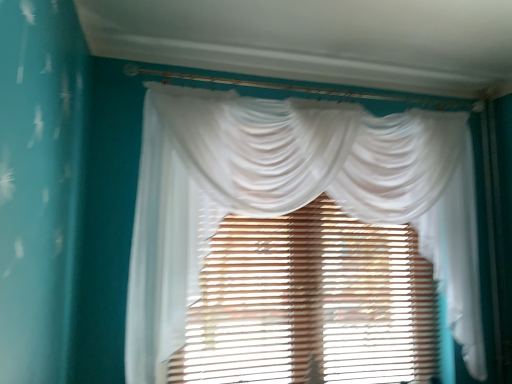
Describe the element at coordinates (311, 303) in the screenshot. The width and height of the screenshot is (512, 384). I see `translucent wood blinds at center` at that location.

You are a GUI agent. You are given a task and a screenshot of the screen. Output one action in this format:
    pyautogui.click(x=<x>, y=<y>)
    Task: Click on the translucent wood blinds at center
    
    Given the screenshot: What is the action you would take?
    pyautogui.click(x=311, y=303)

Identify the location of white sheer curtain at center. This screenshot has height=384, width=512. (290, 197).

Describe the element at coordinates (290, 197) in the screenshot. This screenshot has height=384, width=512. I see `white sheer curtain at center` at that location.

Where is `translucent wood blinds at center`? The height and width of the screenshot is (384, 512). translucent wood blinds at center is located at coordinates (311, 303).

Is white sheer curtain at center at the right side of translucent wood blinds at center?

Yes.

Is the position of white sheer curtain at center less distant than that of translucent wood blinds at center?

Yes, white sheer curtain at center is closer to the camera.

Is point (310, 118) positioned before point (414, 235)?

That is True.

From the image's perspective, is white sheer curtain at center above translucent wood blinds at center?

Yes, from the image's perspective, white sheer curtain at center is above translucent wood blinds at center.

From the picture: From a real-world perspective, which object rests below the other?

translucent wood blinds at center is physically lower.

Which of these two, white sheer curtain at center or translucent wood blinds at center, is wider?

white sheer curtain at center.

Between white sheer curtain at center and translucent wood blinds at center, which one has less height?

Standing shorter between the two is translucent wood blinds at center.

Which of these two, white sheer curtain at center or translucent wood blinds at center, is smaller?

translucent wood blinds at center is smaller.

Is white sheer curtain at center positioned beyond the bounds of translucent wood blinds at center?

Yes, white sheer curtain at center is outside of translucent wood blinds at center.

Is the surface of white sheer curtain at center in direct contact with translucent wood blinds at center?

No, white sheer curtain at center is not beside translucent wood blinds at center.

Is white sheer curtain at center aimed at translucent wood blinds at center?

Yes, white sheer curtain at center is facing translucent wood blinds at center.

How many degrees apart are the facing directions of white sheer curtain at center and translucent wood blinds at center?

There is a 0.586-degree angle between the facing directions of white sheer curtain at center and translucent wood blinds at center.

I want to click on window blind behind the white sheer curtain at center, so click(x=311, y=303).

Does translucent wood blinds at center appear on the left side of white sheer curtain at center?

Yes, translucent wood blinds at center is to the left of white sheer curtain at center.

Which object is closer to the camera, translucent wood blinds at center or white sheer curtain at center?

white sheer curtain at center is closer to the camera.

Does point (255, 255) come behind point (175, 143)?

Yes, it is behind point (175, 143).

From the image's perspective, between translucent wood blinds at center and white sheer curtain at center, who is located below?

translucent wood blinds at center appears lower in the image.

From a real-world perspective, is translucent wood blinds at center below white sheer curtain at center?

Correct, in the physical world, translucent wood blinds at center is lower than white sheer curtain at center.

Considering the sizes of objects translucent wood blinds at center and white sheer curtain at center in the image provided, who is wider, translucent wood blinds at center or white sheer curtain at center?

With larger width is white sheer curtain at center.

From the picture: In terms of height, does translucent wood blinds at center look taller or shorter compared to white sheer curtain at center?

Clearly, translucent wood blinds at center is shorter compared to white sheer curtain at center.

Considering the sizes of objects translucent wood blinds at center and white sheer curtain at center in the image provided, who is smaller, translucent wood blinds at center or white sheer curtain at center?

With smaller size is translucent wood blinds at center.

Is white sheer curtain at center completely or partially inside translucent wood blinds at center?

No, white sheer curtain at center is not inside translucent wood blinds at center.

Based on the photo, can you see translucent wood blinds at center touching white sheer curtain at center?

No, translucent wood blinds at center is not next to white sheer curtain at center.

Is translucent wood blinds at center aimed at white sheer curtain at center?

Yes, translucent wood blinds at center is turned towards white sheer curtain at center.

How different are the orientations of translucent wood blinds at center and white sheer curtain at center in degrees?

There is a 0.586-degree angle between the facing directions of translucent wood blinds at center and white sheer curtain at center.

This screenshot has height=384, width=512. In order to click on window blind that appears behind the white sheer curtain at center in this screenshot , I will do `click(311, 303)`.

Identify the location of window blind that appears below the white sheer curtain at center (from a real-world perspective). Image resolution: width=512 pixels, height=384 pixels. (311, 303).

Find the location of a particular element. curtain above the translucent wood blinds at center (from the image's perspective) is located at coordinates (290, 197).